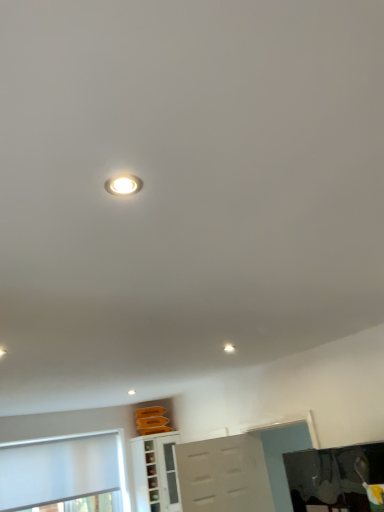
Question: Considering their positions, is white glossy cabinet at lower center located in front of or behind white glossy droplight at center?

Choices:
 (A) behind
 (B) front

Answer: (A)

Question: Is white glossy cabinet at lower center spatially inside white glossy droplight at center, or outside of it?

Choices:
 (A) outside
 (B) inside

Answer: (A)

Question: Which object is the farthest from the white matte window at lower left?

Choices:
 (A) white glossy cabinet at lower center
 (B) white glossy droplight at center

Answer: (B)

Question: Which object is the farthest from the white matte window at lower left?

Choices:
 (A) white glossy droplight at center
 (B) white glossy cabinet at lower center

Answer: (A)